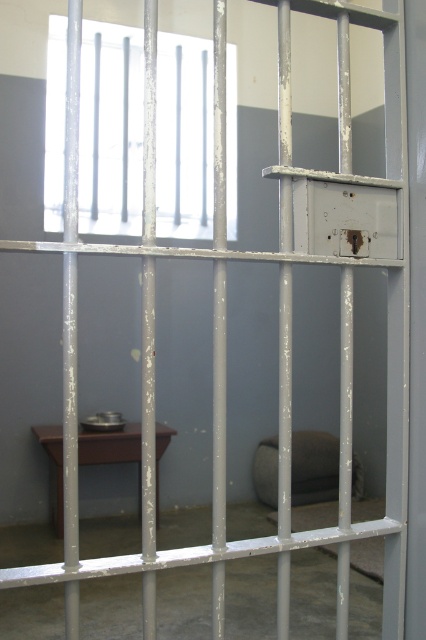
Looking at this image, which is more to the left, transparent glass window at upper center or brown matte stool at lower left?

From the viewer's perspective, transparent glass window at upper center appears more on the left side.

Is transparent glass window at upper center positioned behind brown matte stool at lower left?

That is True.

Which is in front, point (109, 161) or point (108, 435)?

Positioned in front is point (108, 435).

What are the coordinates of `transparent glass window at upper center` in the screenshot? It's located at (111, 129).

Can you confirm if transparent glass window at upper center is bigger than brown fabric stool at center?

Indeed, transparent glass window at upper center has a larger size compared to brown fabric stool at center.

Can you confirm if transparent glass window at upper center is positioned to the left of brown fabric stool at center?

Indeed, transparent glass window at upper center is positioned on the left side of brown fabric stool at center.

Which is behind, point (181, 74) or point (276, 481)?

Point (181, 74)

Image resolution: width=426 pixels, height=640 pixels. Identify the location of transparent glass window at upper center. (111, 129).

Is point (310, 458) positioned before point (127, 460)?

No, (310, 458) is behind (127, 460).

Can you confirm if brown fabric stool at center is positioned to the right of brown matte stool at lower left?

Indeed, brown fabric stool at center is positioned on the right side of brown matte stool at lower left.

Between point (322, 497) and point (46, 444), which one is positioned in front?

Positioned in front is point (46, 444).

This screenshot has height=640, width=426. Identify the location of brown fabric stool at center. click(313, 467).